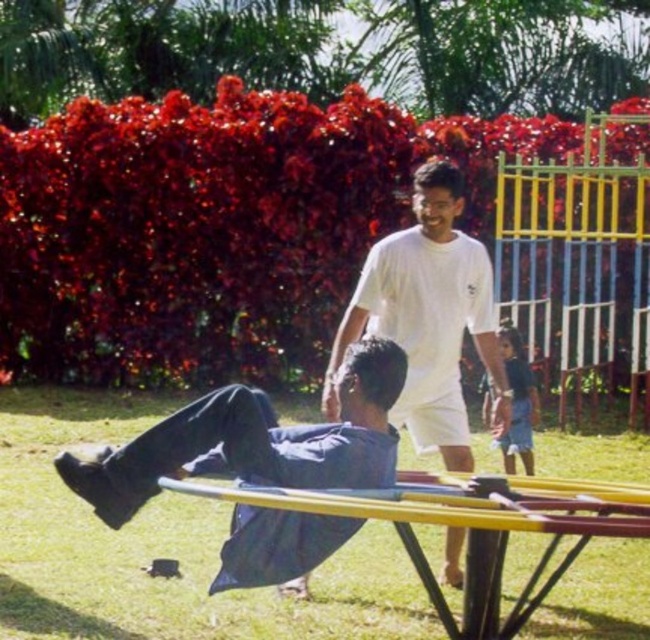
Question: Among these objects, which one is nearest to the camera?

Choices:
 (A) dark blue fabric at center
 (B) blue denim shorts at center
 (C) yellow metallic picnic table at lower center
 (D) white cotton t-shirt at center

Answer: (C)

Question: Among these objects, which one is nearest to the camera?

Choices:
 (A) white cotton t-shirt at center
 (B) blue denim shorts at center
 (C) dark blue fabric at center

Answer: (C)

Question: Is dark blue fabric at center closer to the viewer compared to yellow metallic picnic table at lower center?

Choices:
 (A) no
 (B) yes

Answer: (A)

Question: Can you confirm if yellow metallic picnic table at lower center is positioned to the left of blue denim shorts at center?

Choices:
 (A) yes
 (B) no

Answer: (A)

Question: Where is yellow metallic picnic table at lower center located in relation to blue denim shorts at center in the image?

Choices:
 (A) above
 (B) below

Answer: (B)

Question: Among these objects, which one is farthest from the camera?

Choices:
 (A) white cotton t-shirt at center
 (B) dark blue fabric at center
 (C) yellow metallic picnic table at lower center

Answer: (A)